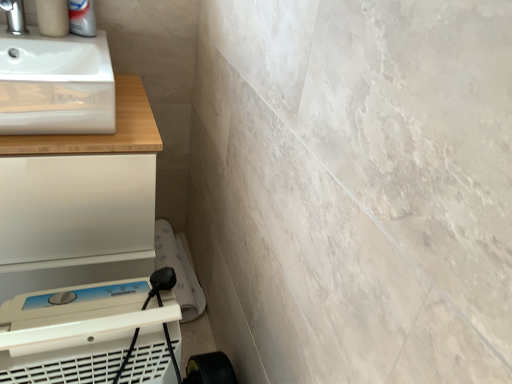
Measure the distance between satin nickel faucet at upper left and camera.

satin nickel faucet at upper left is 3.50 feet from camera.

Find the location of a particular element. The height and width of the screenshot is (384, 512). white matte counter at upper left is located at coordinates (80, 201).

Can you confirm if white glossy sink at upper left is bigger than white matte counter at upper left?

No, white glossy sink at upper left is not bigger than white matte counter at upper left.

Would you consider white glossy sink at upper left to be distant from white matte counter at upper left?

They are positioned close to each other.

How many degrees apart are the facing directions of white glossy sink at upper left and white matte counter at upper left?

9.66e-05 degrees separate the facing orientations of white glossy sink at upper left and white matte counter at upper left.

Which is behind, point (17, 127) or point (0, 139)?

The point (0, 139) is farther.

Can you confirm if satin nickel faucet at upper left is taller than white plastic air purifier at lower left?

No, satin nickel faucet at upper left is not taller than white plastic air purifier at lower left.

Which object is closer to the camera, satin nickel faucet at upper left or white plastic air purifier at lower left?

white plastic air purifier at lower left is in front.

Considering the points (25, 26) and (47, 296), which point is in front, point (25, 26) or point (47, 296)?

Positioned in front is point (47, 296).

Can you confirm if satin nickel faucet at upper left is bigger than white plastic air purifier at lower left?

No.

Considering the sizes of white glossy sink at upper left and white plastic air purifier at lower left in the image, is white glossy sink at upper left taller or shorter than white plastic air purifier at lower left?

In the image, white glossy sink at upper left appears to be shorter than white plastic air purifier at lower left.

Can you confirm if white glossy sink at upper left is bigger than white plastic air purifier at lower left?

No.

Considering the positions of objects white glossy sink at upper left and white plastic air purifier at lower left in the image provided, who is behind, white glossy sink at upper left or white plastic air purifier at lower left?

white glossy sink at upper left is further from the camera.

Identify the location of appliance located in front of the white glossy sink at upper left. tap(93, 333).

Is the depth of white matte counter at upper left less than that of satin nickel faucet at upper left?

That is True.

Considering the points (124, 166) and (18, 14), which point is in front, point (124, 166) or point (18, 14)?

Point (124, 166)

From the picture: From a real-world perspective, is white matte counter at upper left physically below satin nickel faucet at upper left?

Correct, in the physical world, white matte counter at upper left is lower than satin nickel faucet at upper left.

In the scene shown: Is white matte counter at upper left next to satin nickel faucet at upper left?

No, white matte counter at upper left is not beside satin nickel faucet at upper left.

Between white matte counter at upper left and white glossy sink at upper left, which one has smaller size?

With smaller size is white glossy sink at upper left.

Is white glossy sink at upper left completely or partially inside white matte counter at upper left?

No.

Is white matte counter at upper left to the left of white glossy sink at upper left from the viewer's perspective?

Indeed, white matte counter at upper left is positioned on the left side of white glossy sink at upper left.

Is white matte counter at upper left wider than white glossy sink at upper left?

Yes, white matte counter at upper left is wider than white glossy sink at upper left.

In the scene shown: Which object is further away from the camera taking this photo, white plastic air purifier at lower left or white glossy sink at upper left?

white glossy sink at upper left is more distant.

How much distance is there between white plastic air purifier at lower left and white glossy sink at upper left?

A distance of 17.78 inches exists between white plastic air purifier at lower left and white glossy sink at upper left.

Considering the positions of point (99, 295) and point (92, 73), is point (99, 295) closer or farther from the camera than point (92, 73)?

Point (99, 295).

Would you consider white plastic air purifier at lower left to be distant from white glossy sink at upper left?

white plastic air purifier at lower left is near white glossy sink at upper left, not far away.

Which is nearer, (80, 67) or (13, 16)?

Point (80, 67) is positioned farther from the camera compared to point (13, 16).

Can you confirm if white glossy sink at upper left is bigger than satin nickel faucet at upper left?

Indeed, white glossy sink at upper left has a larger size compared to satin nickel faucet at upper left.

Which of these two, white glossy sink at upper left or satin nickel faucet at upper left, is thinner?

satin nickel faucet at upper left.

Locate an element on the screen. The height and width of the screenshot is (384, 512). sink in front of the satin nickel faucet at upper left is located at coordinates (54, 75).

Identify the location of sink that appears in front of the white matte counter at upper left. Image resolution: width=512 pixels, height=384 pixels. (54, 75).

Identify the location of appliance below the satin nickel faucet at upper left (from the image's perspective). Image resolution: width=512 pixels, height=384 pixels. (93, 333).

When comparing their distances from white matte counter at upper left, does white plastic air purifier at lower left or white glossy sink at upper left seem further?

white plastic air purifier at lower left is positioned further to the anchor white matte counter at upper left.

From the image, which object appears to be farther from white plastic air purifier at lower left, satin nickel faucet at upper left or white glossy sink at upper left?

satin nickel faucet at upper left is further to white plastic air purifier at lower left.

Considering their positions, is white glossy sink at upper left positioned further to white matte counter at upper left than white plastic air purifier at lower left?

white plastic air purifier at lower left lies further to white matte counter at upper left than the other object.

Looking at the image, which one is located closer to satin nickel faucet at upper left, white matte counter at upper left or white plastic air purifier at lower left?

white matte counter at upper left.

Considering their positions, is satin nickel faucet at upper left positioned closer to white glossy sink at upper left than white matte counter at upper left?

white matte counter at upper left.

Considering their positions, is white matte counter at upper left positioned closer to white glossy sink at upper left than white plastic air purifier at lower left?

white matte counter at upper left.

Based on their spatial positions, is white matte counter at upper left or satin nickel faucet at upper left closer to white plastic air purifier at lower left?

Based on the image, white matte counter at upper left appears to be nearer to white plastic air purifier at lower left.

Considering their positions, is white matte counter at upper left positioned further to white plastic air purifier at lower left than white glossy sink at upper left?

white glossy sink at upper left is positioned further to the anchor white plastic air purifier at lower left.

The height and width of the screenshot is (384, 512). What are the coordinates of `counter between white glossy sink at upper left and white plastic air purifier at lower left vertically` in the screenshot? It's located at (80, 201).

The height and width of the screenshot is (384, 512). In order to click on sink between satin nickel faucet at upper left and white matte counter at upper left from top to bottom in this screenshot , I will do [54, 75].

The width and height of the screenshot is (512, 384). I want to click on sink that lies between satin nickel faucet at upper left and white plastic air purifier at lower left from top to bottom, so click(54, 75).

The image size is (512, 384). Identify the location of counter between satin nickel faucet at upper left and white plastic air purifier at lower left from top to bottom. (80, 201).